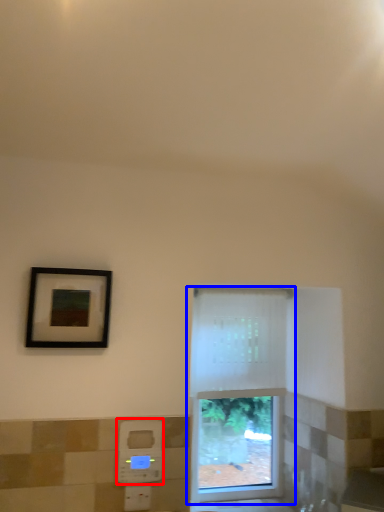
Question: Which object is closer to the camera taking this photo, hand dryer (highlighted by a red box) or window (highlighted by a blue box)?

Choices:
 (A) hand dryer
 (B) window

Answer: (A)